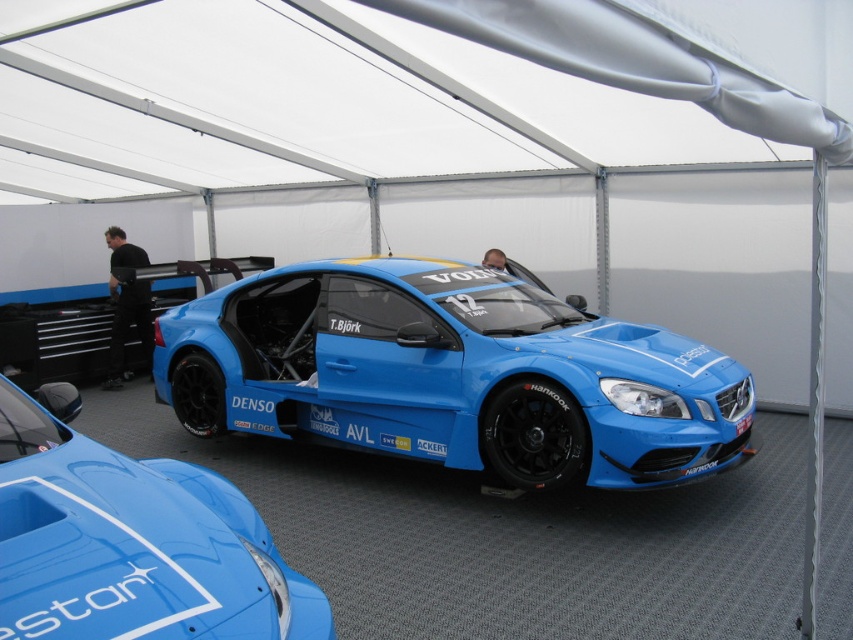
You are a photographer at a motorsport event and need to capture a photo that includes both the glossy blue race car at center and the black fabric man at left. Given the spatial relationship between them, will the car block the man from being fully visible in the shot?

The glossy blue race car at center is bigger than the black fabric man at left, so the car may block the man from being fully visible depending on the camera angle and positioning.

You are standing inside the white tented area where the blue Volvo race car is parked. You notice a point marked at coordinates (409,88). What object is located at this point?

The point at coordinates (409,88) is occupied by the white fabric canopy at upper center.

You are a photographer at a motorsport event. You need to capture a photo of the matte blue race car at center without any obstructions. Is the white fabric canopy at upper center blocking the view of the car?

The white fabric canopy at upper center is located above the matte blue race car at center, so it may block part of the view depending on the angle, but since it is above, positioning the camera below or adjusting the angle could avoid obstruction.